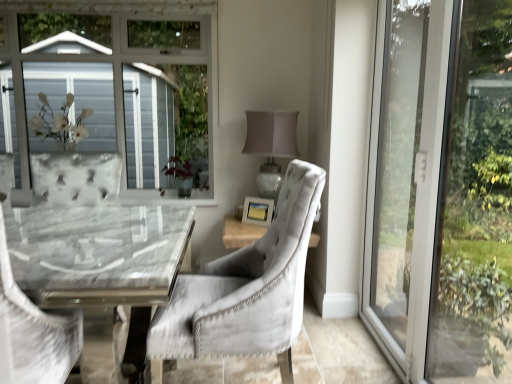
Question: Which direction should I rotate to look at velvet grey chair at center, arranged as the 1th chair when viewed from the right?

Choices:
 (A) left
 (B) right

Answer: (A)

Question: From the image's perspective, is velvet grey chair at center, arranged as the 1th chair when viewed from the right, on top of matte gray lampshade at upper right?

Choices:
 (A) yes
 (B) no

Answer: (B)

Question: Are velvet grey chair at center, arranged as the 1th chair when viewed from the right, and matte gray lampshade at upper right making contact?

Choices:
 (A) yes
 (B) no

Answer: (B)

Question: Does velvet grey chair at center, which appears as the second chair when viewed from the left, lie behind matte gray lampshade at upper right?

Choices:
 (A) no
 (B) yes

Answer: (A)

Question: Would you say matte gray lampshade at upper right is part of velvet grey chair at center, arranged as the 1th chair when viewed from the right,'s contents?

Choices:
 (A) yes
 (B) no

Answer: (B)

Question: From the image's perspective, is velvet grey chair at center, arranged as the 1th chair when viewed from the right, under matte gray lampshade at upper right?

Choices:
 (A) yes
 (B) no

Answer: (A)

Question: Would you say velvet grey chair at center, arranged as the 1th chair when viewed from the right, is outside matte gray lampshade at upper right?

Choices:
 (A) yes
 (B) no

Answer: (A)

Question: From the image's perspective, is green matte plant at center beneath transparent glass door at right?

Choices:
 (A) no
 (B) yes

Answer: (A)

Question: Can we say green matte plant at center lies outside transparent glass door at right?

Choices:
 (A) no
 (B) yes

Answer: (B)

Question: Does green matte plant at center come behind transparent glass door at right?

Choices:
 (A) yes
 (B) no

Answer: (A)

Question: From the image's perspective, is green matte plant at center on transparent glass door at right?

Choices:
 (A) no
 (B) yes

Answer: (B)

Question: Considering the relative sizes of green matte plant at center and transparent glass door at right in the image provided, is green matte plant at center thinner than transparent glass door at right?

Choices:
 (A) yes
 (B) no

Answer: (B)

Question: Can you confirm if green matte plant at center is smaller than transparent glass door at right?

Choices:
 (A) yes
 (B) no

Answer: (A)

Question: Can you confirm if matte gray lampshade at upper right is thinner than velvet grey chair at center, arranged as the 1th chair when viewed from the right?

Choices:
 (A) no
 (B) yes

Answer: (B)